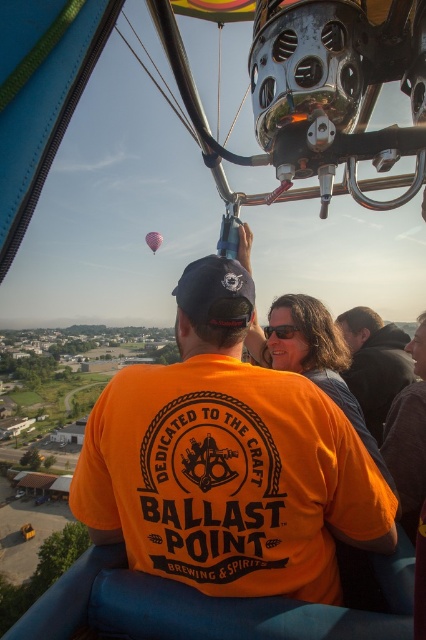
Question: Among these points, which one is nearest to the camera?

Choices:
 (A) (144, 236)
 (B) (353, 385)

Answer: (B)

Question: Is black fuzzy jacket at upper right behind pink fabric balloon at upper center?

Choices:
 (A) no
 (B) yes

Answer: (A)

Question: Does black fuzzy jacket at upper right appear over pink fabric balloon at upper center?

Choices:
 (A) yes
 (B) no

Answer: (B)

Question: Among these objects, which one is farthest from the camera?

Choices:
 (A) black fuzzy jacket at upper right
 (B) pink fabric balloon at upper center
 (C) orange cotton shirt at center

Answer: (B)

Question: Which object appears farthest from the camera in this image?

Choices:
 (A) pink fabric balloon at upper center
 (B) orange cotton shirt at center

Answer: (A)

Question: Is black fuzzy jacket at upper right to the left of pink fabric balloon at upper center from the viewer's perspective?

Choices:
 (A) no
 (B) yes

Answer: (A)